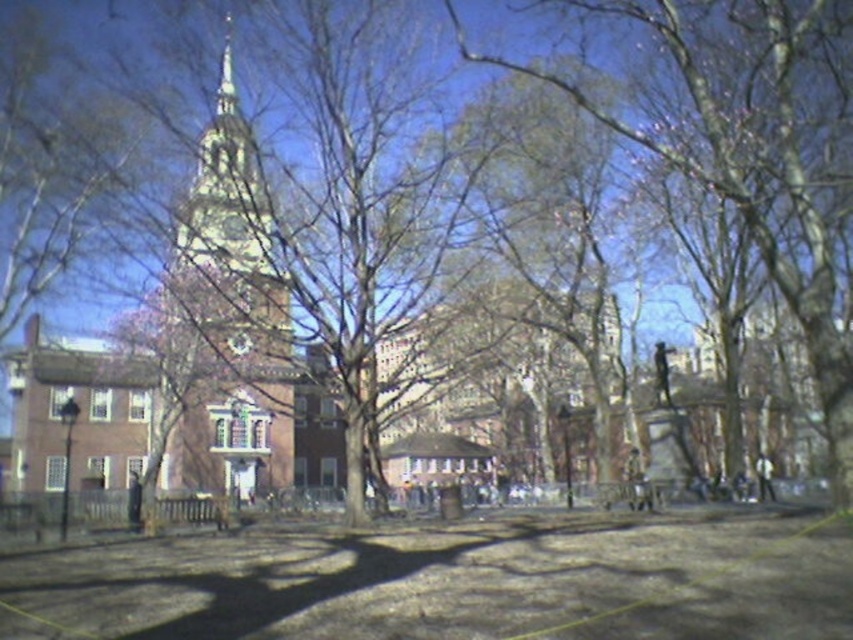
You are a drone operator planning to fly a drone from the shiny silver spire at upper center to the brown brick tower at center. Considering the drone has a wingspan of 1 meter, will there be enough space between the two structures for the drone to pass through?

The brown brick tower at center might be wider than shiny silver spire at upper center, so the space between them may not be sufficient for the drone with a 1 meter wingspan to pass through safely. Check the actual dimensions before proceeding.

You are a photographer trying to capture the brown brick tower at center and the shiny silver spire at upper center in a single shot. Based on their positions, which one will appear closer to the camera in your photo?

The brown brick tower at center appears closer to the camera because it is positioned in front of the shiny silver spire at upper center, so the tower will block part of the spire in the photo.